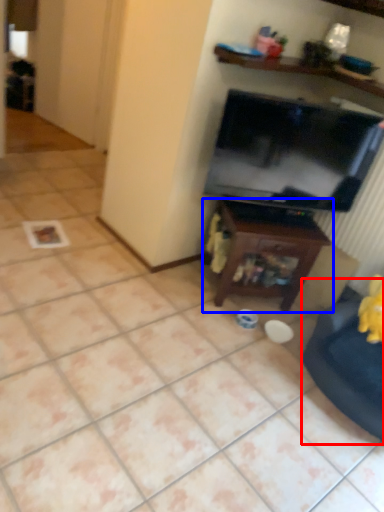
Question: Which of the following is the closest to the observer, swivel chair (highlighted by a red box) or table (highlighted by a blue box)?

Choices:
 (A) swivel chair
 (B) table

Answer: (A)